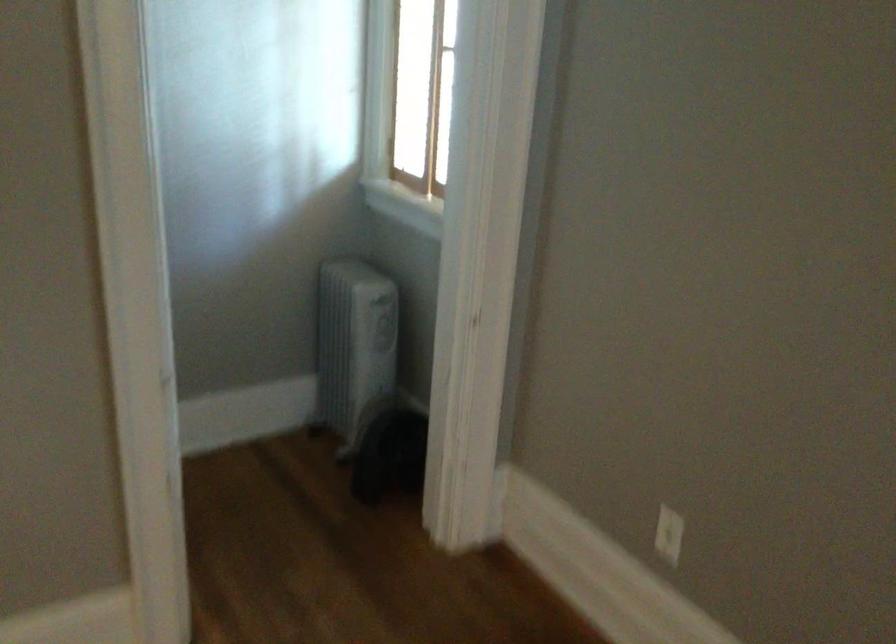
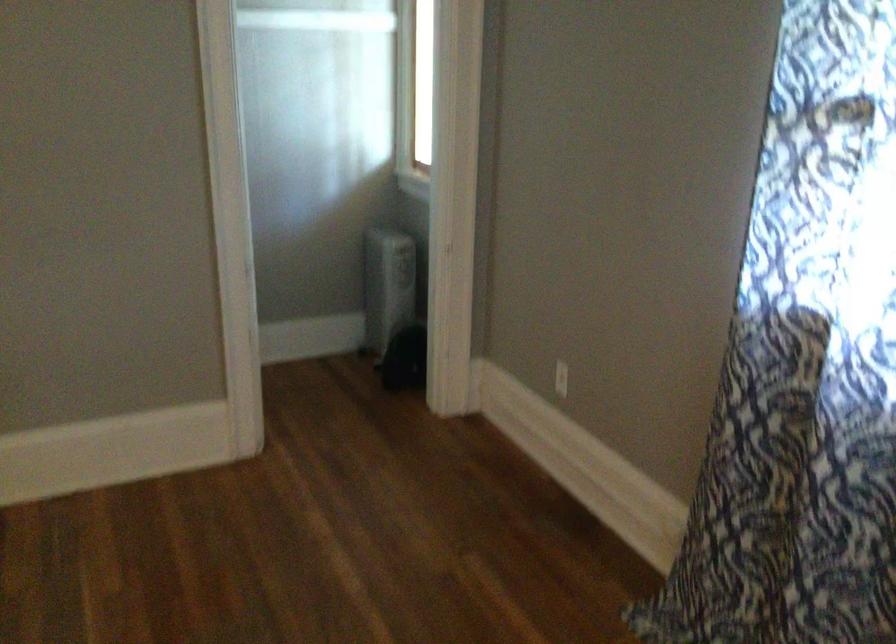
Find the pixel in the second image that matches pixel 358 346 in the first image.

(388, 285)